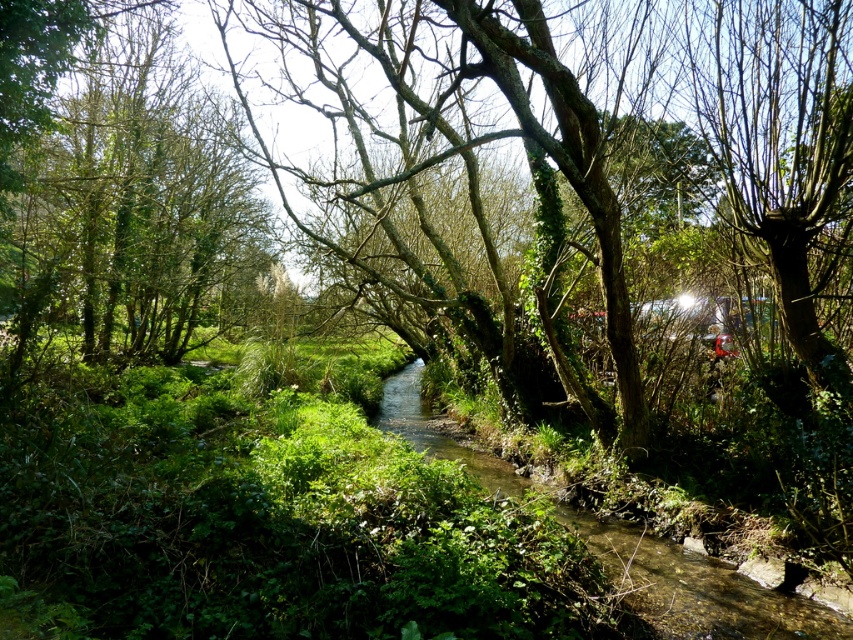
What do you see at coordinates (129, 208) in the screenshot? Image resolution: width=853 pixels, height=640 pixels. I see `green leafy tree at left` at bounding box center [129, 208].

Between point (221, 147) and point (486, 458), which one is positioned behind?

Point (221, 147)

The width and height of the screenshot is (853, 640). Identify the location of green leafy tree at left. (129, 208).